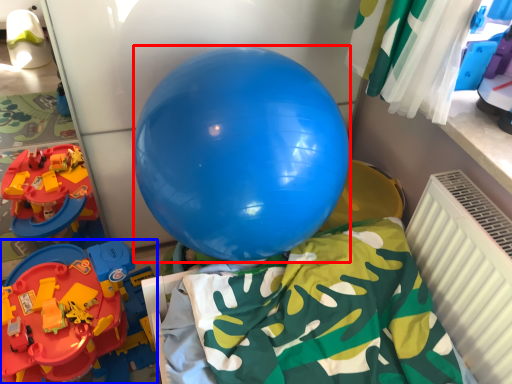
Question: Which object appears closest to the camera in this image, balloon (highlighted by a red box) or toy (highlighted by a blue box)?

Choices:
 (A) balloon
 (B) toy

Answer: (A)